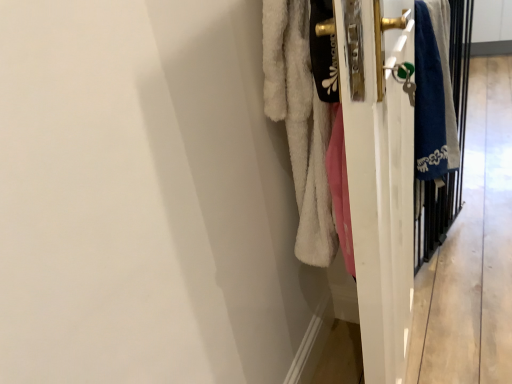
Question: From the image's perspective, is blue fabric screen door at right on white fluffy towel at right?

Choices:
 (A) yes
 (B) no

Answer: (A)

Question: From a real-world perspective, is blue fabric screen door at right over white fluffy towel at right?

Choices:
 (A) yes
 (B) no

Answer: (A)

Question: Is blue fabric screen door at right positioned before white fluffy towel at right?

Choices:
 (A) no
 (B) yes

Answer: (A)

Question: Is blue fabric screen door at right at the left side of white fluffy towel at right?

Choices:
 (A) yes
 (B) no

Answer: (B)

Question: From the image's perspective, is blue fabric screen door at right under white fluffy towel at right?

Choices:
 (A) no
 (B) yes

Answer: (A)

Question: Is point (440, 228) closer or farther from the camera than point (442, 311)?

Choices:
 (A) closer
 (B) farther

Answer: (B)

Question: From a real-world perspective, is blue fabric screen door at right above or below blue towel at right?

Choices:
 (A) below
 (B) above

Answer: (B)

Question: Is blue fabric screen door at right spatially inside blue towel at right, or outside of it?

Choices:
 (A) outside
 (B) inside

Answer: (B)

Question: Looking at their shapes, would you say blue fabric screen door at right is wider or thinner than blue towel at right?

Choices:
 (A) thin
 (B) wide

Answer: (B)

Question: Choose the correct answer: Is white fluffy towel at right inside blue towel at right or outside it?

Choices:
 (A) inside
 (B) outside

Answer: (B)

Question: Is point (322, 109) closer or farther from the camera than point (445, 254)?

Choices:
 (A) closer
 (B) farther

Answer: (A)

Question: In terms of height, does white fluffy towel at right look taller or shorter compared to blue towel at right?

Choices:
 (A) short
 (B) tall

Answer: (B)

Question: From the image's perspective, is white fluffy towel at right positioned above or below blue towel at right?

Choices:
 (A) below
 (B) above

Answer: (A)

Question: Considering the positions of blue towel at right and white fluffy towel at right in the image, is blue towel at right bigger or smaller than white fluffy towel at right?

Choices:
 (A) small
 (B) big

Answer: (A)

Question: In the image, is blue towel at right on the left side or the right side of white fluffy towel at right?

Choices:
 (A) left
 (B) right

Answer: (B)